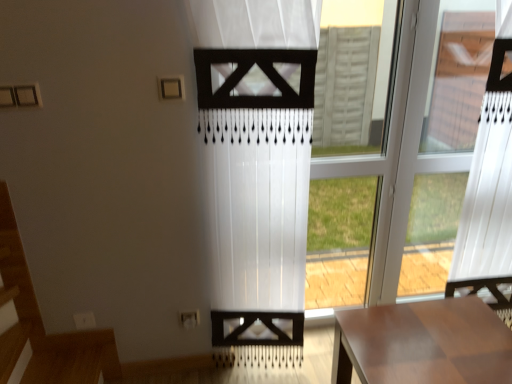
Question: Can you confirm if wooden table at lower right is wider than transparent glass window at center?

Choices:
 (A) no
 (B) yes

Answer: (B)

Question: Is the surface of wooden table at lower right in direct contact with transparent glass window at center?

Choices:
 (A) no
 (B) yes

Answer: (A)

Question: Does wooden table at lower right have a larger size compared to transparent glass window at center?

Choices:
 (A) yes
 (B) no

Answer: (A)

Question: From the image's perspective, is wooden table at lower right below transparent glass window at center?

Choices:
 (A) no
 (B) yes

Answer: (B)

Question: Is wooden table at lower right positioned beyond the bounds of transparent glass window at center?

Choices:
 (A) no
 (B) yes

Answer: (B)

Question: Is transparent plastic window at right inside the boundaries of white sheer curtain at center, or outside?

Choices:
 (A) outside
 (B) inside

Answer: (A)

Question: Considering the relative positions of transparent plastic window at right and white sheer curtain at center in the image provided, is transparent plastic window at right to the left or to the right of white sheer curtain at center?

Choices:
 (A) left
 (B) right

Answer: (B)

Question: In terms of width, does transparent plastic window at right look wider or thinner when compared to white sheer curtain at center?

Choices:
 (A) wide
 (B) thin

Answer: (A)

Question: From the image's perspective, is transparent plastic window at right above or below white sheer curtain at center?

Choices:
 (A) below
 (B) above

Answer: (B)

Question: In terms of height, does transparent plastic window at right look taller or shorter compared to transparent glass window at center?

Choices:
 (A) short
 (B) tall

Answer: (A)

Question: Relative to transparent glass window at center, is transparent plastic window at right in front or behind?

Choices:
 (A) behind
 (B) front

Answer: (B)

Question: Based on their sizes in the image, would you say transparent plastic window at right is bigger or smaller than transparent glass window at center?

Choices:
 (A) big
 (B) small

Answer: (A)

Question: In the image, is transparent plastic window at right on the left side or the right side of transparent glass window at center?

Choices:
 (A) right
 (B) left

Answer: (A)

Question: Considering the relative positions of wooden table at lower right and transparent plastic window at right in the image provided, is wooden table at lower right to the left or to the right of transparent plastic window at right?

Choices:
 (A) left
 (B) right

Answer: (A)

Question: In the image, is wooden table at lower right positioned in front of or behind transparent plastic window at right?

Choices:
 (A) behind
 (B) front

Answer: (B)